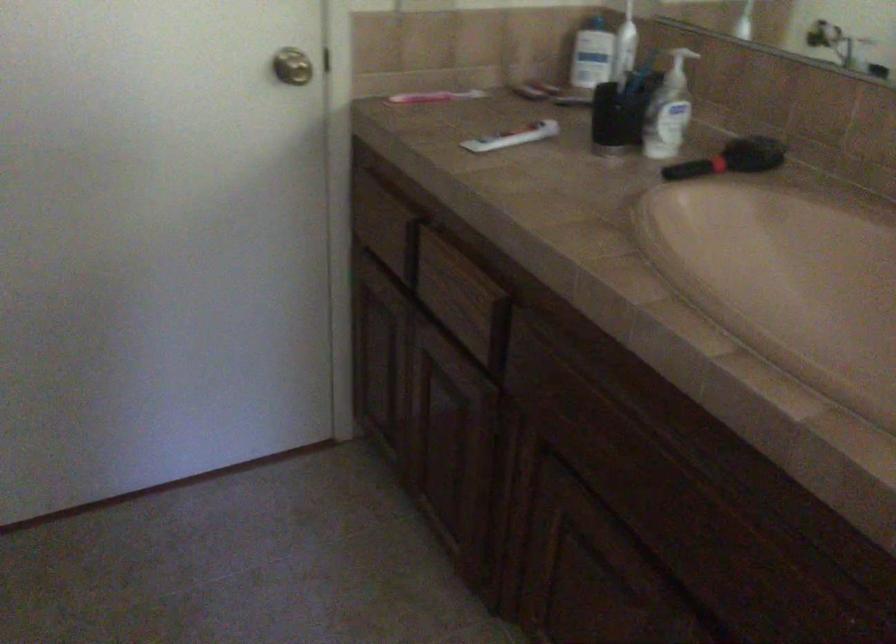
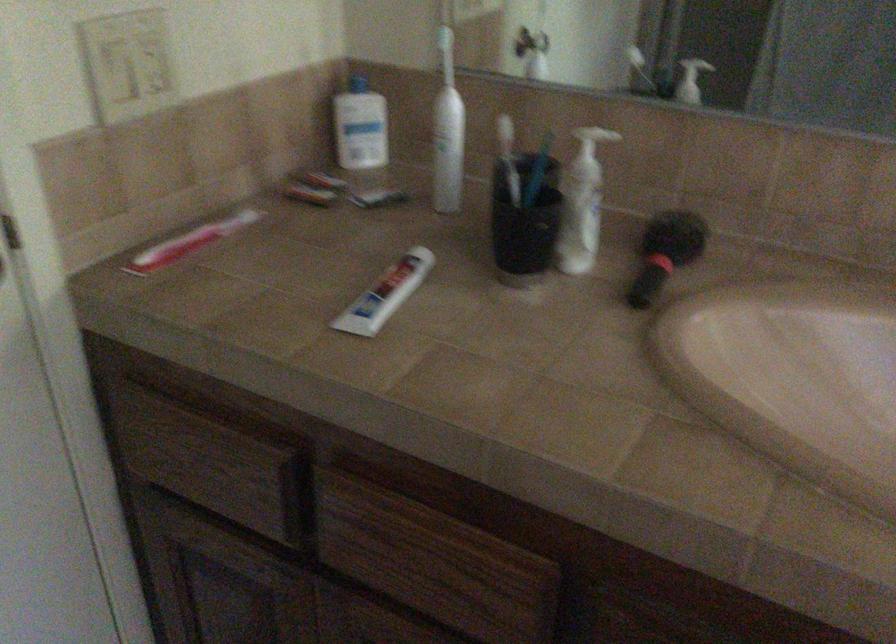
Locate, in the second image, the point that corresponds to [502,131] in the first image.

(385, 294)